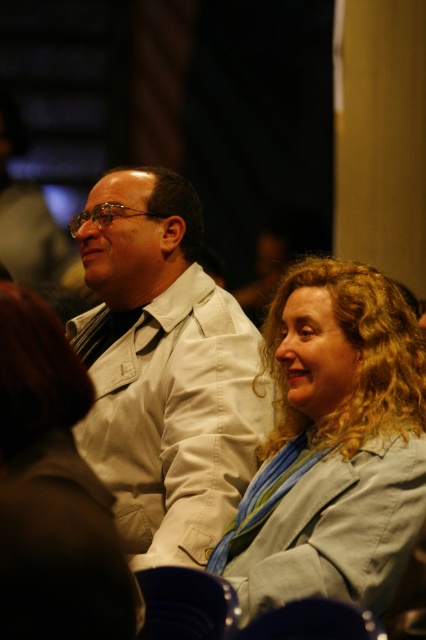
You are taking a photo of the two people in the scene. You want to focus on the person closer to the camera. Which point should you focus on, point (155,429) or point (389,353)?

Point (155,429) is further to the camera than point (389,353), so you should focus on point (155,429) to capture the person closer to the camera.

You are a photographer trying to capture a clear shot of the light beige jacket at center and the light blue fabric jacket at center. Since the background is blurry, which jacket should you focus on to ensure it appears sharp in the photo?

The light beige jacket at center is located above the light blue fabric jacket at center. Since the background is blurry, focusing on the light beige jacket at center would ensure it appears sharp as it is closer to the camera.

You are organizing a charity event and need to display two jackets on a mannequin. The jackets are the light beige jacket at center and the light blue fabric jacket at center. Which jacket should you choose if you want the one that is bigger?

The light beige jacket at center is larger in size than the light blue fabric jacket at center, so you should choose the light beige jacket at center for the bigger size.